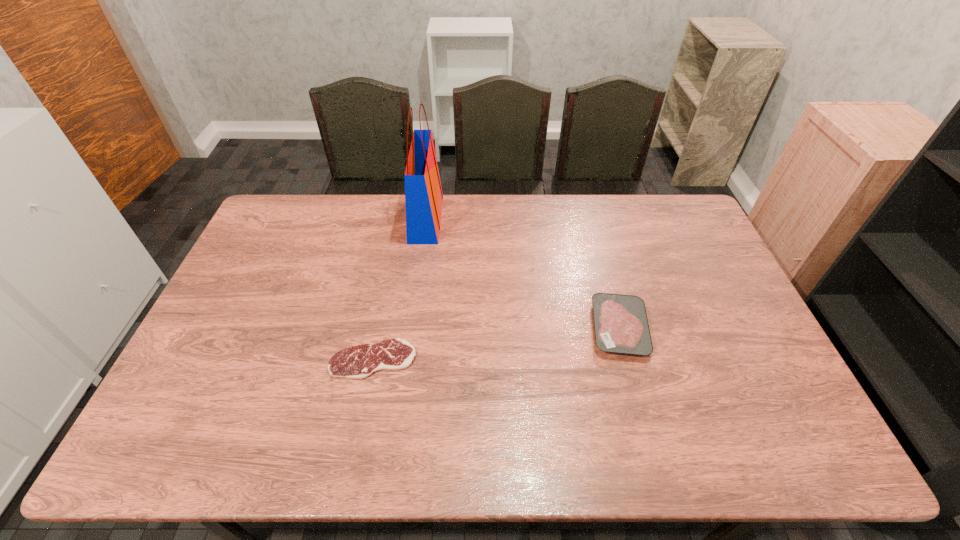
The width and height of the screenshot is (960, 540). In order to click on the farthest object in this screenshot , I will do `click(423, 193)`.

Locate an element on the screen. This screenshot has height=540, width=960. shopping bag is located at coordinates (423, 193).

The height and width of the screenshot is (540, 960). Find the location of `the rightmost object`. the rightmost object is located at coordinates (620, 321).

Where is `the second shortest object`? This screenshot has width=960, height=540. the second shortest object is located at coordinates tap(620, 321).

At what (x,y) coordinates should I click in order to perform the action: click on the shorter steak. Please return your answer as a coordinate pair (x, y). Image resolution: width=960 pixels, height=540 pixels. Looking at the image, I should click on (357, 362).

Find the location of a particular element. The width and height of the screenshot is (960, 540). the left steak is located at coordinates (357, 362).

At what (x,y) coordinates should I click in order to perform the action: click on free space located on the handle side of the farthest object. Please return your answer as a coordinate pair (x, y). Looking at the image, I should click on (461, 219).

Identify the location of vacant point located on the left of the rightmost object. (520, 328).

The height and width of the screenshot is (540, 960). I want to click on vacant region located on the right of the shortest object, so click(x=526, y=359).

Where is `object that is positioned at the far edge`? The height and width of the screenshot is (540, 960). object that is positioned at the far edge is located at coordinates (423, 193).